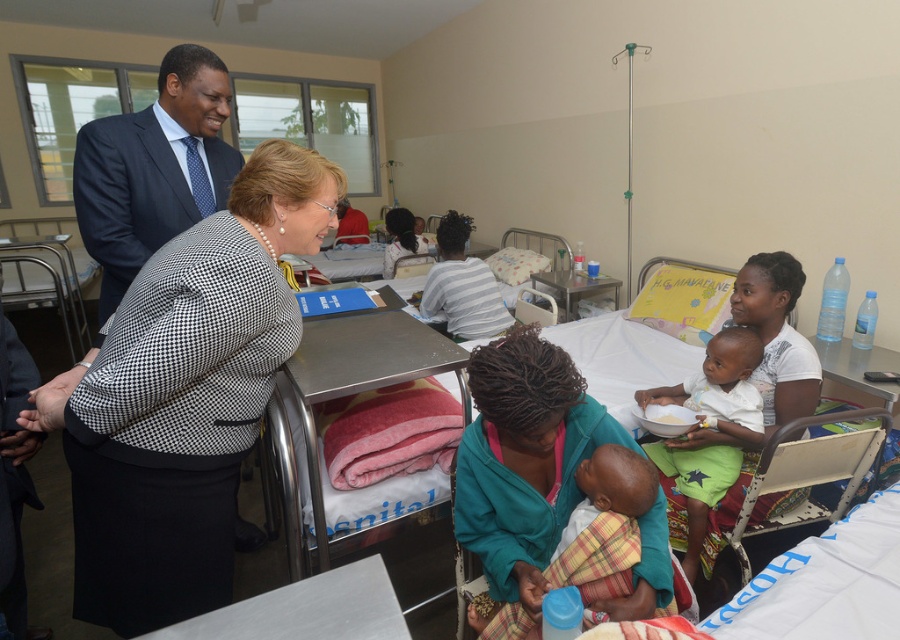
You are a nurse in the hospital ward. You need to locate the black houndstooth blazer at center and the green cotton shorts at lower right. Which one is nearer to you?

The black houndstooth blazer at center is closer to the viewer than the green cotton shorts at lower right.

You are a nurse in the hospital ward. You need to check on the plaid fabric baby at center and the green cotton shorts at lower right. Which one should you attend to first based on their proximity to you?

You should attend to the plaid fabric baby at center first because it is closer to you than the green cotton shorts at lower right.

In the hospital ward scene, there is a plaid fabric baby at center and a green cotton shorts at lower right. Which object is wider?

The plaid fabric baby at center is wider than the green cotton shorts at lower right.